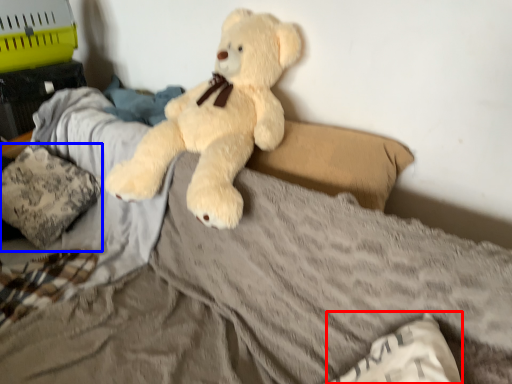
Question: Which object appears closest to the camera in this image, pillow (highlighted by a red box) or pillow (highlighted by a blue box)?

Choices:
 (A) pillow
 (B) pillow

Answer: (A)